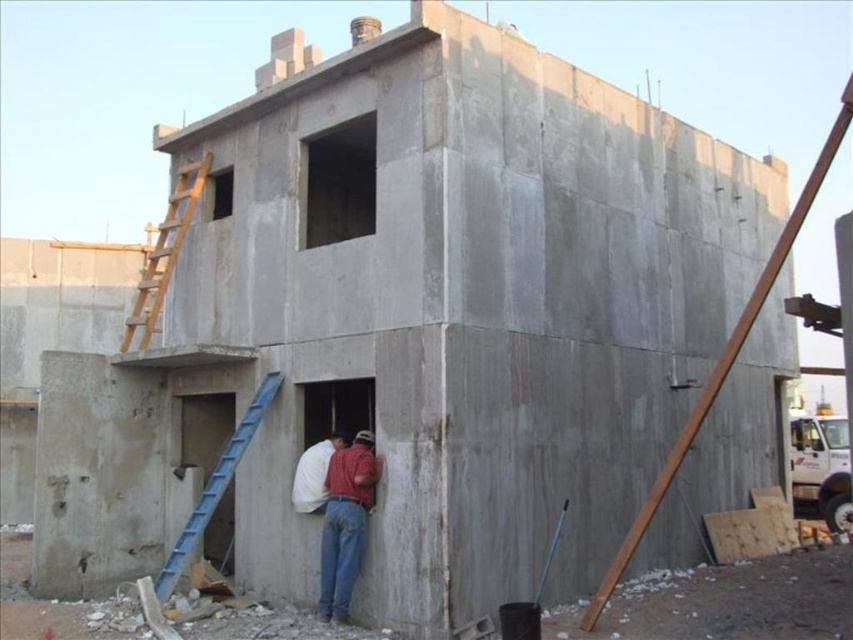
Does wooden ladder at upper left come behind white matte shirt at center?

Yes, it is behind white matte shirt at center.

Which is more to the left, wooden ladder at upper left or white matte shirt at center?

wooden ladder at upper left

Locate an element on the screen. Image resolution: width=853 pixels, height=640 pixels. wooden ladder at upper left is located at coordinates (164, 253).

Where is `wooden ladder at upper left`? Image resolution: width=853 pixels, height=640 pixels. wooden ladder at upper left is located at coordinates (164, 253).

Does blue plastic ladder at lower left have a greater height compared to white matte shirt at center?

Yes, blue plastic ladder at lower left is taller than white matte shirt at center.

Does blue plastic ladder at lower left have a lesser height compared to white matte shirt at center?

No, blue plastic ladder at lower left is not shorter than white matte shirt at center.

Which is behind, point (223, 461) or point (325, 456)?

The point (223, 461) is more distant.

This screenshot has height=640, width=853. What are the coordinates of `blue plastic ladder at lower left` in the screenshot? It's located at (215, 484).

Is red shirt at center to the right of white matte shirt at center from the viewer's perspective?

Correct, you'll find red shirt at center to the right of white matte shirt at center.

Is red shirt at center below white matte shirt at center?

Answer: Yes.

What do you see at coordinates (345, 522) in the screenshot?
I see `red shirt at center` at bounding box center [345, 522].

Identify the location of red shirt at center. Image resolution: width=853 pixels, height=640 pixels. (345, 522).